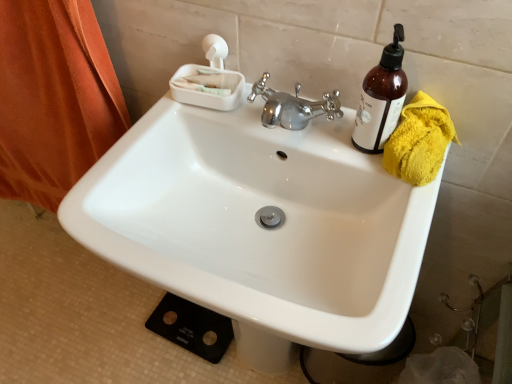
Question: Is white plastic soap dish at upper center at the right side of translucent amber bottle at upper right?

Choices:
 (A) yes
 (B) no

Answer: (B)

Question: Is white plastic soap dish at upper center thinner than translucent amber bottle at upper right?

Choices:
 (A) no
 (B) yes

Answer: (A)

Question: From the image's perspective, is white plastic soap dish at upper center located above translucent amber bottle at upper right?

Choices:
 (A) no
 (B) yes

Answer: (B)

Question: Is white plastic soap dish at upper center far away from translucent amber bottle at upper right?

Choices:
 (A) yes
 (B) no

Answer: (B)

Question: Considering the relative sizes of white plastic soap dish at upper center and translucent amber bottle at upper right in the image provided, is white plastic soap dish at upper center shorter than translucent amber bottle at upper right?

Choices:
 (A) yes
 (B) no

Answer: (A)

Question: Could you tell me if white plastic soap dish at upper center is facing translucent amber bottle at upper right?

Choices:
 (A) no
 (B) yes

Answer: (A)

Question: Is white glossy sink at center aimed at yellow fluffy towel at right?

Choices:
 (A) no
 (B) yes

Answer: (A)

Question: Considering the relative positions of white glossy sink at center and yellow fluffy towel at right in the image provided, is white glossy sink at center in front of yellow fluffy towel at right?

Choices:
 (A) no
 (B) yes

Answer: (B)

Question: Is yellow fluffy towel at right inside white glossy sink at center?

Choices:
 (A) no
 (B) yes

Answer: (A)

Question: Is white glossy sink at center outside yellow fluffy towel at right?

Choices:
 (A) yes
 (B) no

Answer: (A)

Question: From a real-world perspective, is white glossy sink at center over yellow fluffy towel at right?

Choices:
 (A) no
 (B) yes

Answer: (A)

Question: Does white glossy sink at center appear on the left side of yellow fluffy towel at right?

Choices:
 (A) yes
 (B) no

Answer: (A)

Question: Does yellow fluffy towel at right come in front of white glossy sink at center?

Choices:
 (A) yes
 (B) no

Answer: (B)